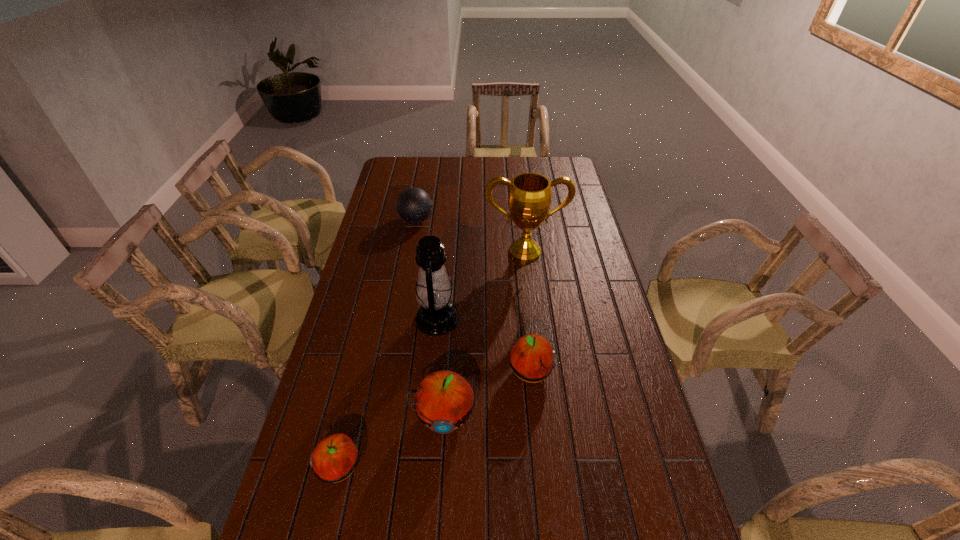
Where is `the nearest apple`? the nearest apple is located at coordinates [335, 457].

Where is `the nearest object`? The image size is (960, 540). the nearest object is located at coordinates (335, 457).

Locate an element on the screen. the second apple from left to right is located at coordinates (444, 400).

Locate an element on the screen. the rightmost apple is located at coordinates (532, 358).

I want to click on the farthest object, so click(414, 205).

Locate an element on the screen. The height and width of the screenshot is (540, 960). the fourth nearest object is located at coordinates (436, 316).

In order to click on award in this screenshot , I will do `click(529, 200)`.

Where is `free space located 0.140m on the right of the nearest object`? The image size is (960, 540). free space located 0.140m on the right of the nearest object is located at coordinates (418, 465).

Find the location of a particular element. Image resolution: width=960 pixels, height=540 pixels. vacant space located 0.250m on the back of the second apple from left to right is located at coordinates (449, 325).

Locate an element on the screen. vacant space located 0.080m on the right of the rightmost apple is located at coordinates (580, 373).